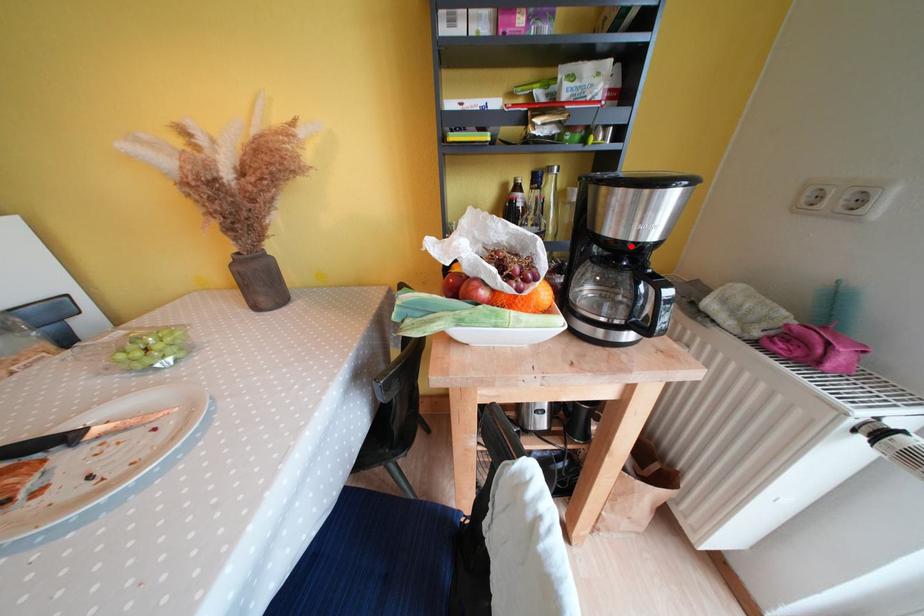
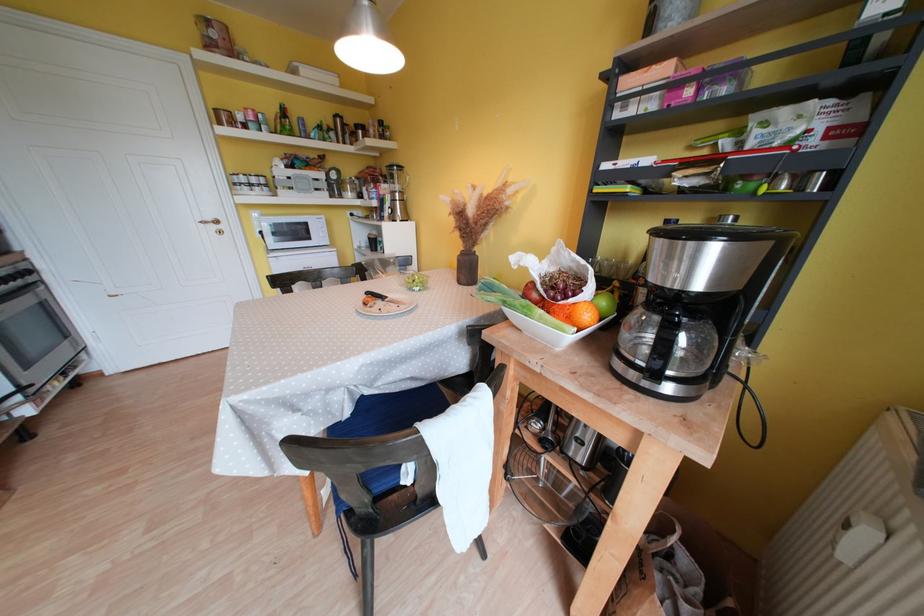
Question: I am providing you with two images of the same scene from different viewpoints. A red point is marked on the first image. At the location where the point appears in image 1, is it still visible in image 2?

Choices:
 (A) Yes
 (B) No

Answer: (A)